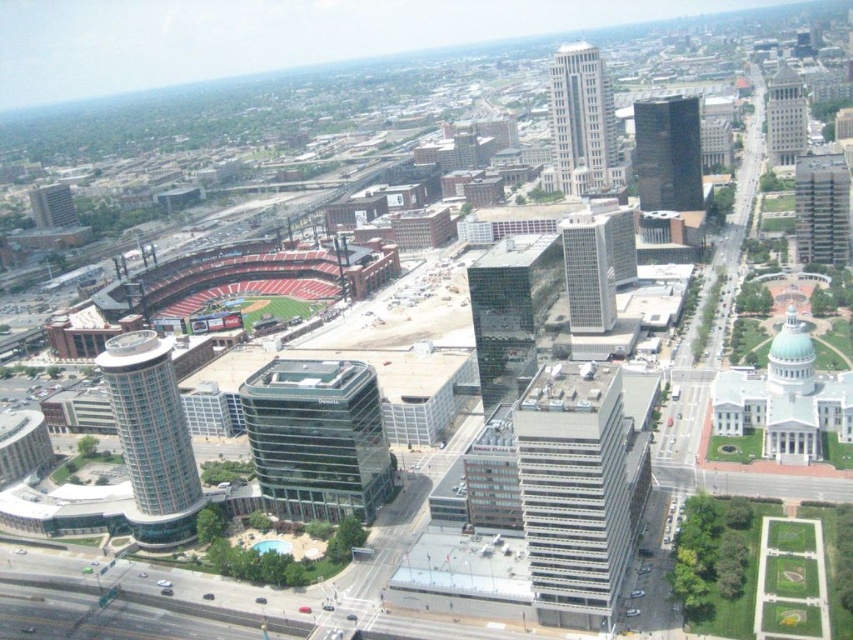
You are a city planner reviewing this aerial view. You need to determine which of the two buildings, the gray glass skyscraper at upper right or the matte glass building at upper left, has a greater horizontal span. Based on the image, which one is wider?

The gray glass skyscraper at upper right is wider than the matte glass building at upper left according to the description.

You are a city planner evaluating the distance between two key buildings for a new transportation project. The project requires a minimum distance of 300 meters between the two buildings to ensure safety standards. Given the gray glass skyscraper at upper right and the matte glass building at upper left, do these two buildings meet the safety distance requirement?

The gray glass skyscraper at upper right and the matte glass building at upper left are 379.73 meters apart from each other, which exceeds the required 300 meters, so they meet the safety distance requirement.

You are a city planner reviewing this aerial image. You need to determine the spatial relationship between the gray glass skyscraper at upper right and the matte glass building at upper left. Which one is positioned higher in the image?

The gray glass skyscraper at upper right is positioned higher in the image than the matte glass building at upper left.